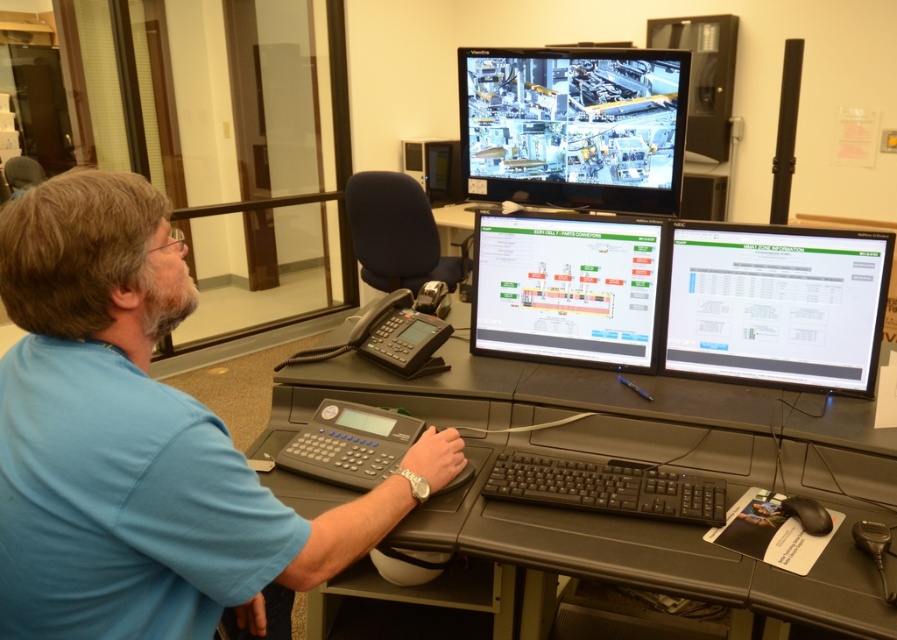
Who is positioned more to the left, blue fabric shirt at center or white glossy monitor at center?

From the viewer's perspective, blue fabric shirt at center appears more on the left side.

Does blue fabric shirt at center come behind white glossy monitor at center?

No, it is in front of white glossy monitor at center.

Is point (119, 227) positioned behind point (585, 336)?

No, it is not.

This screenshot has width=897, height=640. I want to click on blue fabric shirt at center, so click(141, 444).

Does black plastic computer desk at center appear on the right side of white glossy monitor at center?

In fact, black plastic computer desk at center is to the left of white glossy monitor at center.

Image resolution: width=897 pixels, height=640 pixels. What are the coordinates of `black plastic computer desk at center` in the screenshot? It's located at (634, 460).

Who is more distant from viewer, (476,356) or (640,330)?

Point (476,356)

Where is `black plastic computer desk at center`? This screenshot has height=640, width=897. black plastic computer desk at center is located at coordinates (634, 460).

Can you confirm if matte black monitor at upper center is wider than white glossy monitor at center?

Correct, the width of matte black monitor at upper center exceeds that of white glossy monitor at center.

Is matte black monitor at upper center smaller than white glossy monitor at center?

Actually, matte black monitor at upper center might be larger than white glossy monitor at center.

Describe the element at coordinates (573, 125) in the screenshot. The height and width of the screenshot is (640, 897). I see `matte black monitor at upper center` at that location.

At what (x,y) coordinates should I click in order to perform the action: click on matte black monitor at upper center. Please return your answer as a coordinate pair (x, y). The image size is (897, 640). Looking at the image, I should click on (573, 125).